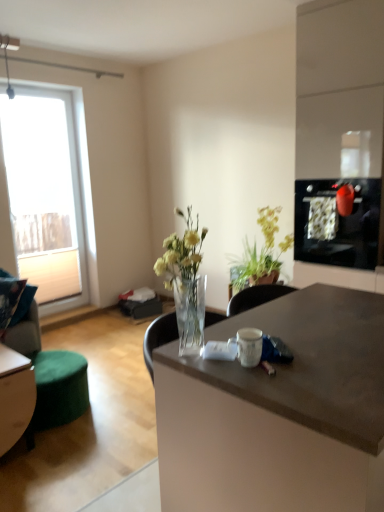
You are a GUI agent. You are given a task and a screenshot of the screen. Output one action in this format:
    pyautogui.click(x=<x>, y=<y>)
    Task: Click on the free space that is in between green fabric ottoman at lower left and green fabric swivel chair at lower left
    
    Given the screenshot: What is the action you would take?
    pyautogui.click(x=66, y=429)